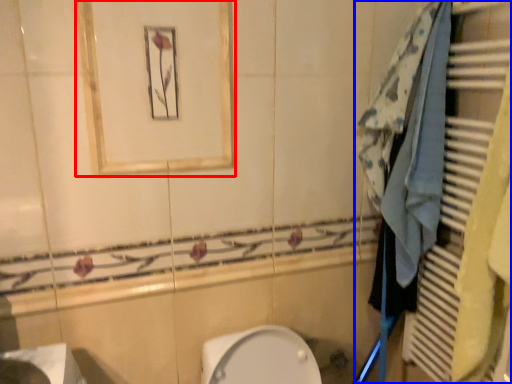
Question: Which of the following is the farthest to the observer, medicine cabinet (highlighted by a red box) or closet (highlighted by a blue box)?

Choices:
 (A) medicine cabinet
 (B) closet

Answer: (A)